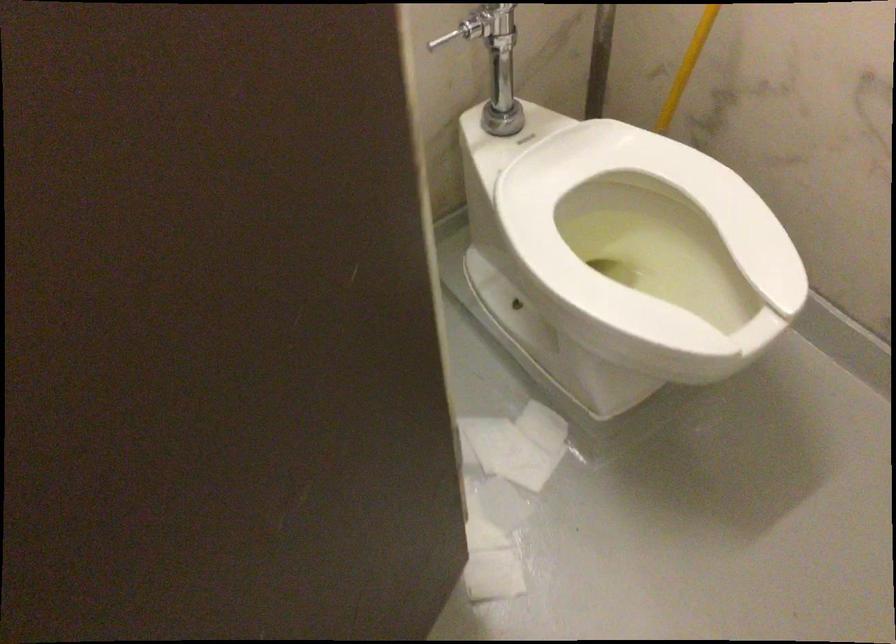
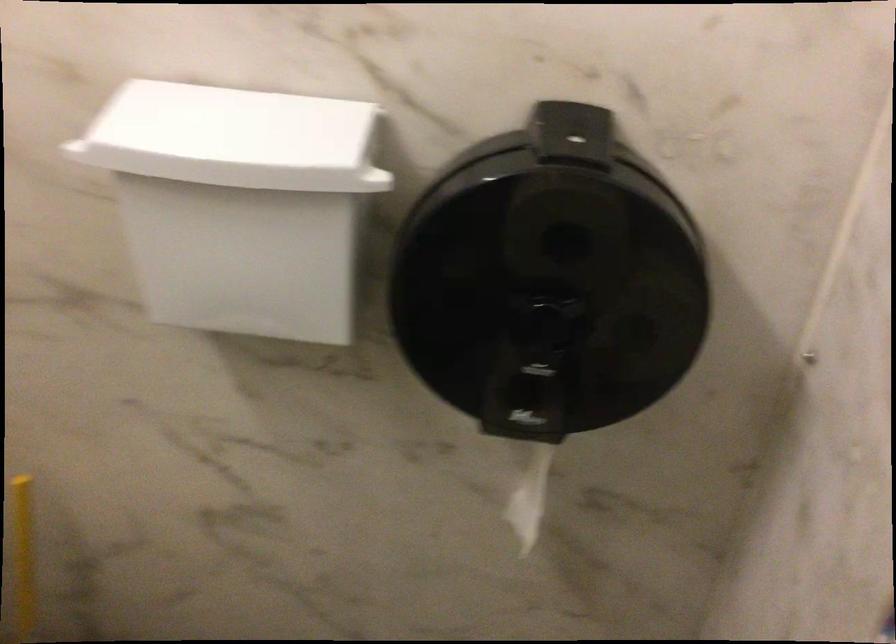
Question: The camera is either moving clockwise (left) or counter-clockwise (right) around the object. The first image is from the beginning of the video and the second image is from the end. Is the camera moving left or right when shooting the video?

Choices:
 (A) Left
 (B) Right

Answer: (A)